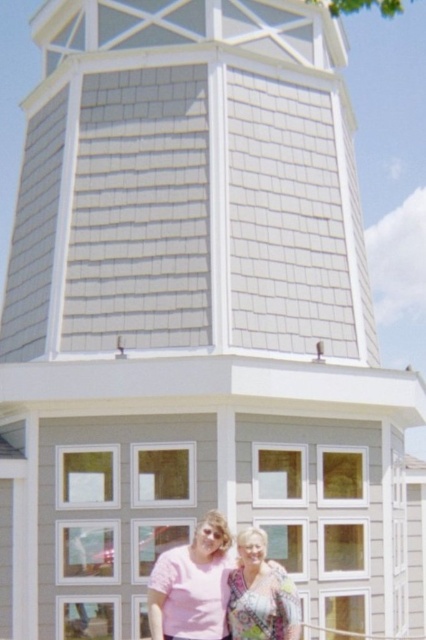
You are taking a photo of the two people in front of the building. The pink matte shirt at lower center and the patterned fabric blouse at lower center are both in the frame. Based on their positions, which clothing item might block the other from view if the camera angle is slightly shifted to the right?

The pink matte shirt at lower center might block the patterned fabric blouse at lower center from view if the camera angle shifts to the right, as it is wider and could obscure the other.

You are taking a photo of two people wearing the pink matte shirt at lower center and the patterned fabric blouse at lower center. Which clothing item appears bigger in the photo?

The pink matte shirt at lower center appears bigger in the photo because it is larger in size than the patterned fabric blouse at lower center.